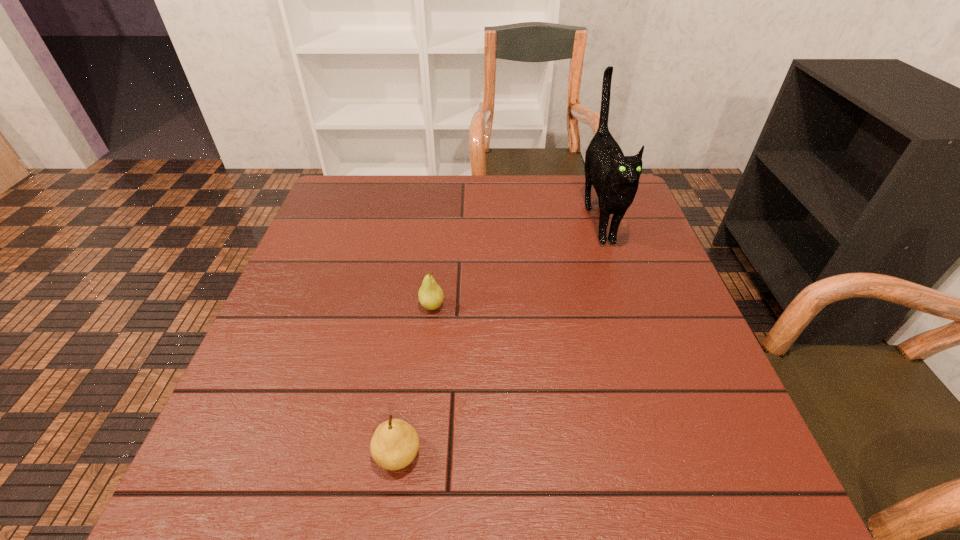
You are a GUI agent. You are given a task and a screenshot of the screen. Output one action in this format:
    pyautogui.click(x=<x>, y=<y>)
    Task: Click on the vacant space that is in between the farther pear and the rightmost object
    The image size is (960, 540).
    Given the screenshot: What is the action you would take?
    pyautogui.click(x=515, y=262)

Find the location of a particular element. Image resolution: width=960 pixels, height=540 pixels. empty location between the nearer pear and the cat is located at coordinates (498, 336).

Where is `vacant space in between the nearest object and the cat`? The width and height of the screenshot is (960, 540). vacant space in between the nearest object and the cat is located at coordinates (498, 336).

Where is `free space between the farther pear and the tallest object`? The image size is (960, 540). free space between the farther pear and the tallest object is located at coordinates (515, 262).

I want to click on blank region between the nearer pear and the rightmost object, so click(x=498, y=336).

The width and height of the screenshot is (960, 540). I want to click on vacant area that lies between the second nearest object and the nearest object, so click(x=415, y=380).

The height and width of the screenshot is (540, 960). I want to click on vacant point located between the rightmost object and the second farthest object, so click(515, 262).

Identify the location of vacant space that's between the farther pear and the cat. (515, 262).

Where is `object that ranks as the second closest to the rightmost object`? The height and width of the screenshot is (540, 960). object that ranks as the second closest to the rightmost object is located at coordinates (395, 443).

Identify which object is the second nearest to the second nearest object. Please provide its 2D coordinates. Your answer should be formatted as a tuple, i.e. [(x, y)], where the tuple contains the x and y coordinates of a point satisfying the conditions above.

[(615, 177)]